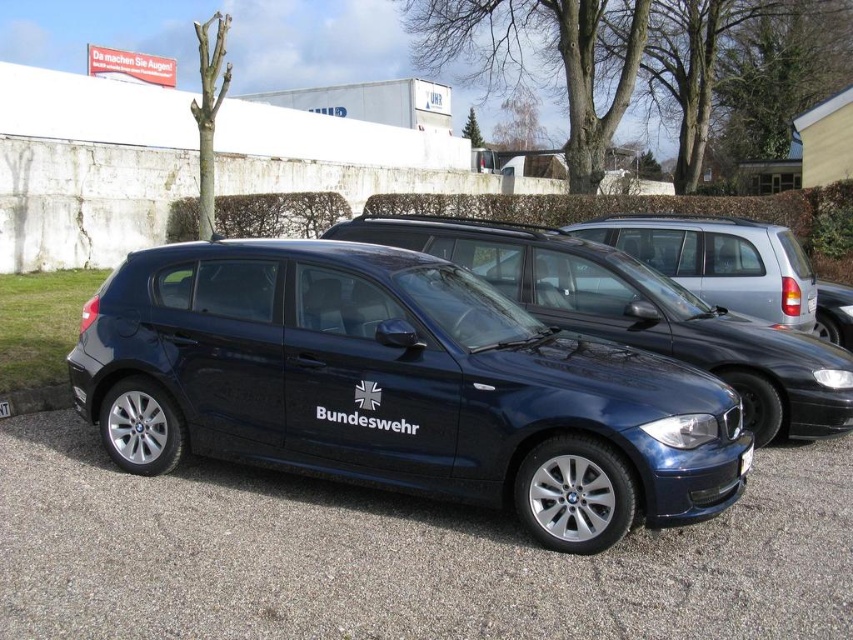
You are a drone operator tasked with capturing aerial footage of the satin black sedan at center. The drone must hover exactly above the sedan to get the best shot. Given the coordinates provided, what are the exact coordinates where the drone should hover to capture the sedan?

The drone should hover exactly at the coordinates provided for the satin black sedan at center, which are point [398,387].

You are a delivery driver who needs to park your truck, which is 4 meters long, in the parking area. The satin black sedan at center is blocking the path. Can you safely maneuver around it to park your truck without hitting the sedan?

The satin black sedan at center is 3.72 meters from the camera. Since your truck is 4 meters long, which is longer than the distance available, you cannot safely maneuver around it without risking a collision. You should wait for the sedan to move first.